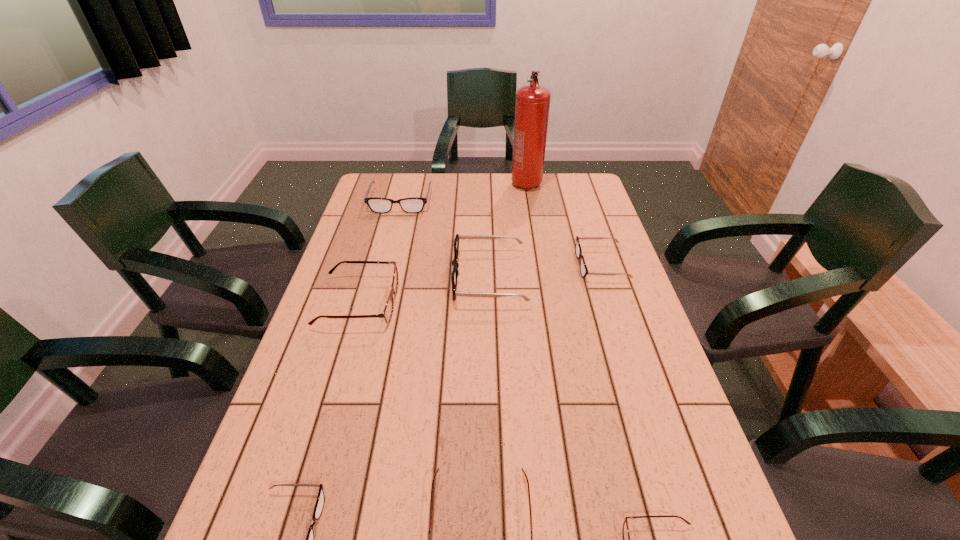
The width and height of the screenshot is (960, 540). Find the location of `red fire extinguisher`. red fire extinguisher is located at coordinates (532, 103).

Locate an element on the screen. the tallest object is located at coordinates (532, 103).

You are a GUI agent. You are given a task and a screenshot of the screen. Output one action in this format:
    pyautogui.click(x=<x>, y=<y>)
    Task: Click on the tallest spectacles
    This screenshot has height=540, width=960.
    Given the screenshot: What is the action you would take?
    pyautogui.click(x=455, y=264)

Image resolution: width=960 pixels, height=540 pixels. What are the coordinates of `the seventh shortest object` in the screenshot? It's located at (455, 264).

Image resolution: width=960 pixels, height=540 pixels. In order to click on the farthest black spectacles in this screenshot , I will do `click(414, 204)`.

The height and width of the screenshot is (540, 960). I want to click on the third smallest black spectacles, so click(414, 204).

Locate an element on the screen. This screenshot has width=960, height=540. the biggest red spectacles is located at coordinates (388, 310).

This screenshot has height=540, width=960. I want to click on the leftmost red spectacles, so click(x=388, y=310).

You are a GUI agent. You are given a task and a screenshot of the screen. Output one action in this format:
    pyautogui.click(x=<x>, y=<y>)
    Task: Click on the second smallest black spectacles
    
    Given the screenshot: What is the action you would take?
    pyautogui.click(x=578, y=251)

Find the location of a particular element. vacant region located 0.290m on the handle side the tallest object is located at coordinates (536, 241).